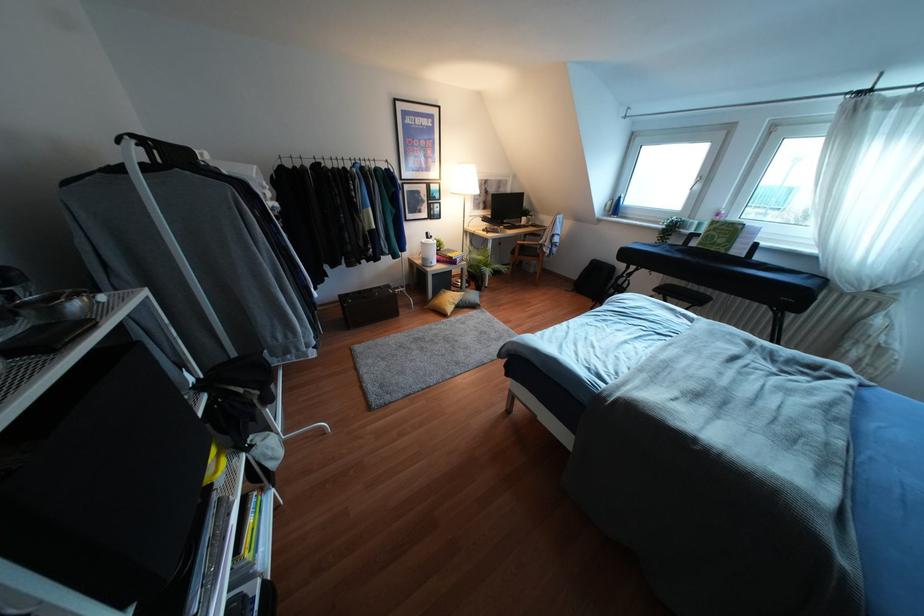
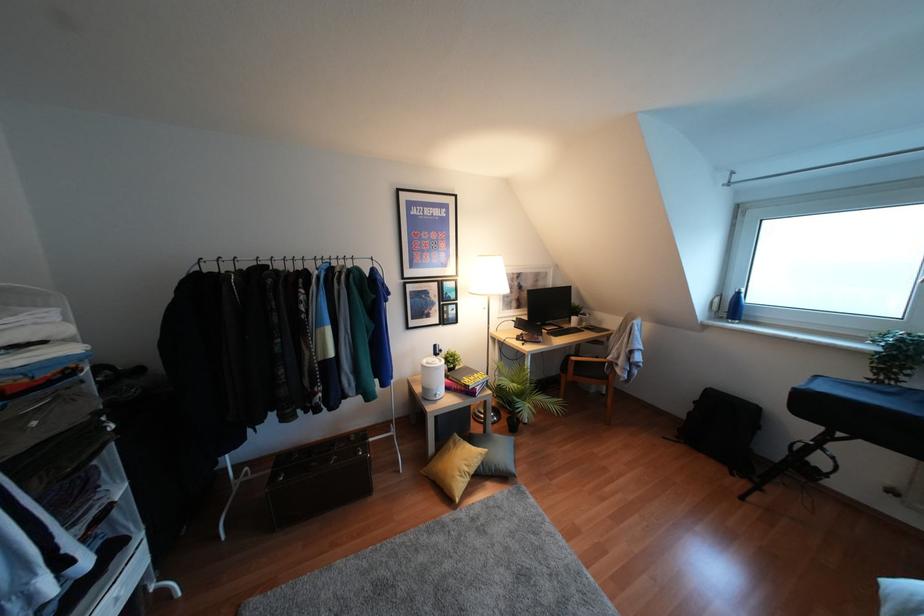
Question: What movement of the cameraman would produce the second image?

Choices:
 (A) Left
 (B) Right
 (C) Forward
 (D) Backward

Answer: (C)